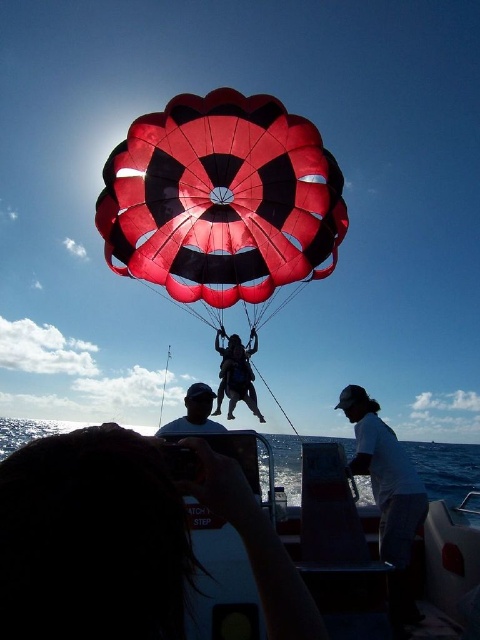
Based on the photo, you are on a boat and looking towards the shore. You see the transparent blue water at lower center and the matte white cap at center. Which object is closer to your left side?

The transparent blue water at lower center is to the left of the matte white cap at center, so it is closer to your left side.

You are standing on the boat and see two points in the sky. The first point is at coordinate point(462, 452) and the second is at point(212, 420). Which point is closer to you?

Point(212, 420) is closer to you because it is in front of point(462, 452).

You are a photographer on a boat trying to capture a photo of the parasailers. You notice the transparent blue water at lower center and the matte white cap at center. Which object should you focus on first to ensure both are in the frame?

You should focus on the transparent blue water at lower center first because it is in front of the matte white cap at center, ensuring both are within the frame by starting with the closer object.